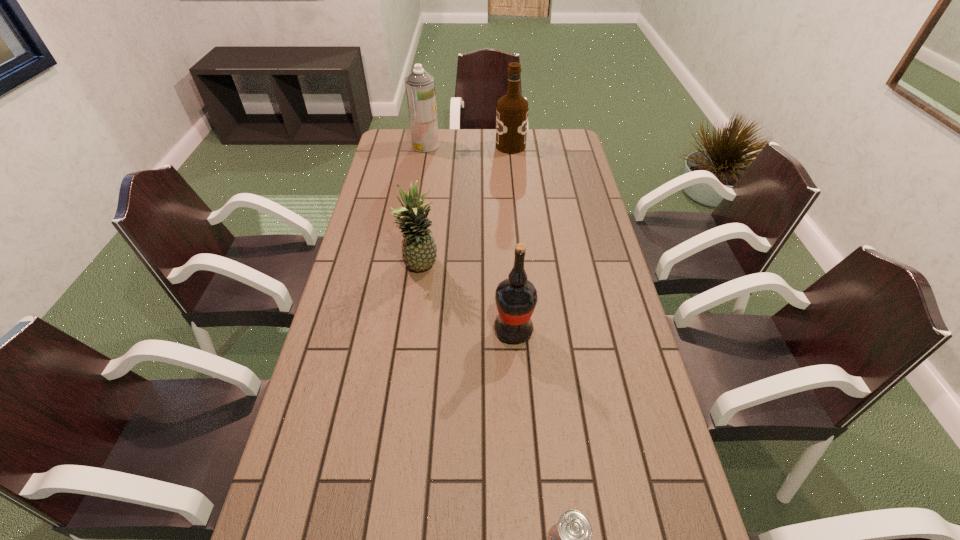
Image resolution: width=960 pixels, height=540 pixels. I want to click on alcohol located at the far edge, so click(512, 109).

The height and width of the screenshot is (540, 960). Find the location of `aerosol can that is at the far edge`. aerosol can that is at the far edge is located at coordinates (420, 88).

You are a GUI agent. You are given a task and a screenshot of the screen. Output one action in this format:
    pyautogui.click(x=<x>, y=<y>)
    Task: Click on the object positioned at the left edge
    The image size is (960, 540).
    Given the screenshot: What is the action you would take?
    pyautogui.click(x=420, y=88)

Image resolution: width=960 pixels, height=540 pixels. I want to click on object present at the far left corner, so click(x=420, y=88).

Where is `vacant space at the far edge of the desktop`? The height and width of the screenshot is (540, 960). vacant space at the far edge of the desktop is located at coordinates (454, 131).

At what (x,y) coordinates should I click in order to perform the action: click on blank space at the left edge of the desktop. Please return your answer as a coordinate pair (x, y). The height and width of the screenshot is (540, 960). Looking at the image, I should click on (352, 353).

I want to click on free location at the right edge of the desktop, so click(x=575, y=169).

What are the coordinates of `vacant space at the far left corner of the desktop` in the screenshot? It's located at (409, 154).

Find the location of a particular element. This screenshot has width=960, height=540. vacant area that lies between the wine bottle and the aerosol can is located at coordinates (469, 238).

The width and height of the screenshot is (960, 540). Find the location of `empty space that is in between the alcohol and the wine bottle`. empty space that is in between the alcohol and the wine bottle is located at coordinates (512, 238).